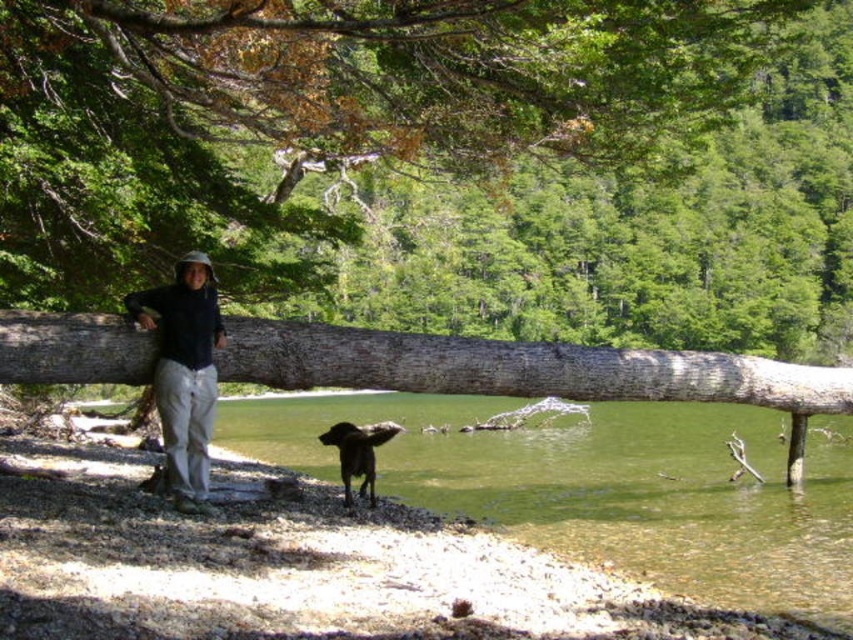
Question: Which point is closer to the camera?

Choices:
 (A) (804, 124)
 (B) (349, 497)
 (C) (184, 308)

Answer: (C)

Question: Does smooth brown log at center appear over shiny brown fur at lower center?

Choices:
 (A) no
 (B) yes

Answer: (B)

Question: Which point is closer to the camera?

Choices:
 (A) (247, 358)
 (B) (173, 371)

Answer: (B)

Question: Which object is the closest to the gray rough wood log at center?

Choices:
 (A) smooth brown log at center
 (B) shiny brown fur at lower center

Answer: (B)

Question: Is gray rough wood log at center above shiny brown fur at lower center?

Choices:
 (A) no
 (B) yes

Answer: (B)

Question: Is smooth brown log at center wider than black matte jacket at center?

Choices:
 (A) yes
 (B) no

Answer: (A)